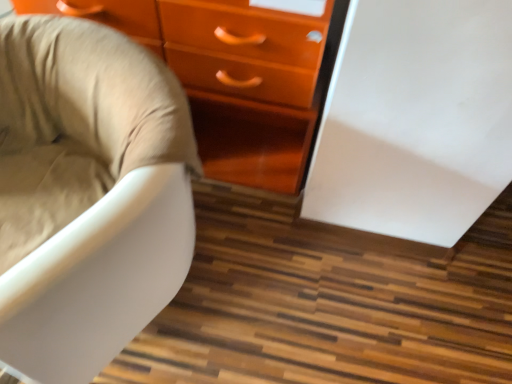
Question: From a real-world perspective, is beige fabric chair at left physically located above or below glossy orange chest of drawers at center?

Choices:
 (A) above
 (B) below

Answer: (B)

Question: Is beige fabric chair at left wider or thinner than glossy orange chest of drawers at center?

Choices:
 (A) wide
 (B) thin

Answer: (A)

Question: Do you think beige fabric chair at left is within glossy orange chest of drawers at center, or outside of it?

Choices:
 (A) outside
 (B) inside

Answer: (A)

Question: Based on their positions, is glossy orange chest of drawers at center located to the left or right of beige fabric chair at left?

Choices:
 (A) right
 (B) left

Answer: (A)

Question: Is glossy orange chest of drawers at center wider or thinner than beige fabric chair at left?

Choices:
 (A) wide
 (B) thin

Answer: (B)

Question: Considering the positions of glossy orange chest of drawers at center and beige fabric chair at left in the image, is glossy orange chest of drawers at center bigger or smaller than beige fabric chair at left?

Choices:
 (A) big
 (B) small

Answer: (A)

Question: From a real-world perspective, is glossy orange chest of drawers at center above or below beige fabric chair at left?

Choices:
 (A) below
 (B) above

Answer: (B)